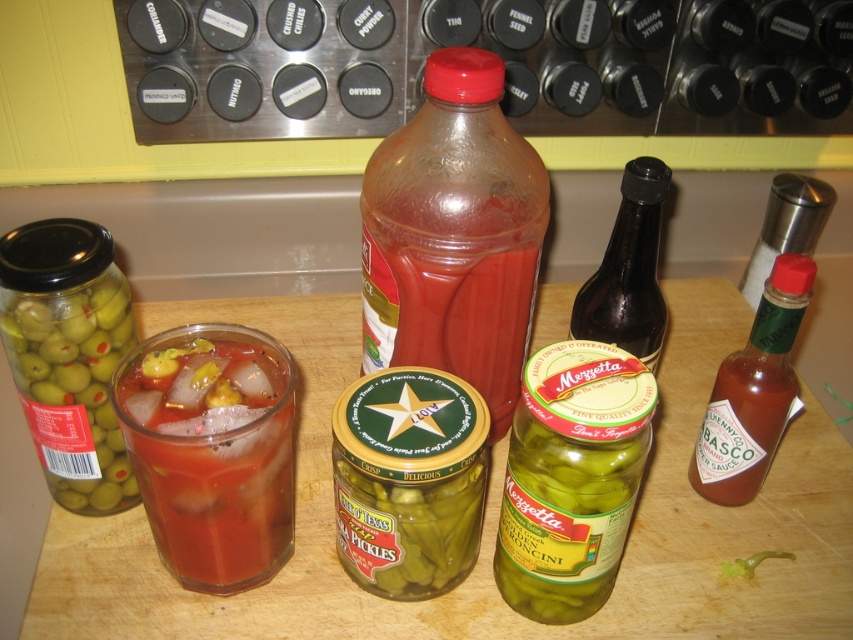
Question: Considering the relative positions of translucent plastic bottle at center and translucent glass drink at center in the image provided, where is translucent plastic bottle at center located with respect to translucent glass drink at center?

Choices:
 (A) right
 (B) left

Answer: (A)

Question: Does translucent plastic bottle at center appear over translucent glass drink at center?

Choices:
 (A) yes
 (B) no

Answer: (A)

Question: Which point is closer to the camera taking this photo?

Choices:
 (A) (511, 168)
 (B) (764, 340)
 (C) (248, 561)

Answer: (C)

Question: Which object is positioned closest to the dark brown glass bottle at center-right?

Choices:
 (A) translucent plastic bottle at center
 (B) red glass tabasco sauce at right

Answer: (B)

Question: Among these points, which one is farthest from the camera?

Choices:
 (A) (199, 570)
 (B) (642, 346)

Answer: (B)

Question: From the image, what is the correct spatial relationship of translucent plastic bottle at center in relation to translucent glass drink at center?

Choices:
 (A) above
 (B) below

Answer: (A)